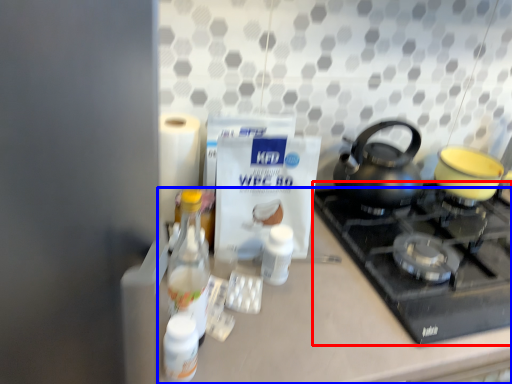
Question: Which point is closer to the camera, gas stove (highlighted by a red box) or counter (highlighted by a blue box)?

Choices:
 (A) gas stove
 (B) counter

Answer: (B)